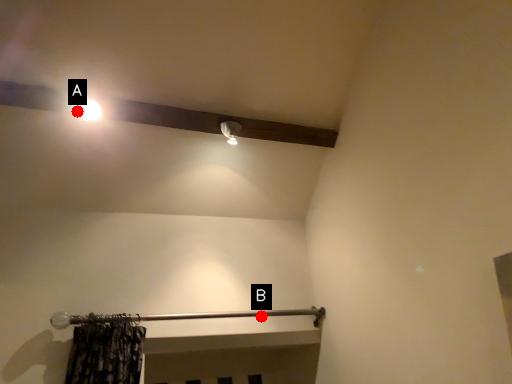
Question: Two points are circled on the image, labeled by A and B beside each circle. Which point appears farthest from the camera in this image?

Choices:
 (A) A is further
 (B) B is further

Answer: (B)